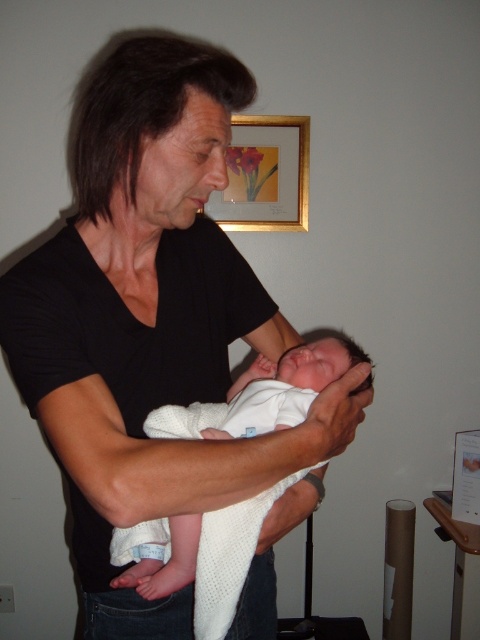
Question: Observing the image, what is the correct spatial positioning of gold-framed artwork at upper center in reference to white knitted cloth at center?

Choices:
 (A) below
 (B) above

Answer: (B)

Question: Considering the real-world distances, which object is closest to the gold-framed artwork at upper center?

Choices:
 (A) black matte shirt at center
 (B) white knitted cloth at center

Answer: (A)

Question: Which of the following is the closest to the observer?

Choices:
 (A) [x=195, y=387]
 (B) [x=245, y=204]

Answer: (A)

Question: Where is black matte shirt at center located in relation to gold-framed artwork at upper center in the image?

Choices:
 (A) below
 (B) above

Answer: (A)

Question: Which object is farther from the camera taking this photo?

Choices:
 (A) black matte shirt at center
 (B) white knitted cloth at center

Answer: (B)

Question: Can you confirm if gold-framed artwork at upper center is smaller than white knitted cloth at center?

Choices:
 (A) yes
 (B) no

Answer: (A)